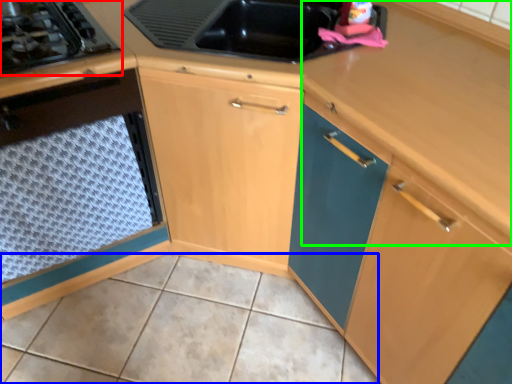
Question: Based on their relative distances, which object is nearer to gas stove (highlighted by a red box)? Choose from tile (highlighted by a blue box) and counter top (highlighted by a green box).

Choices:
 (A) tile
 (B) counter top

Answer: (B)